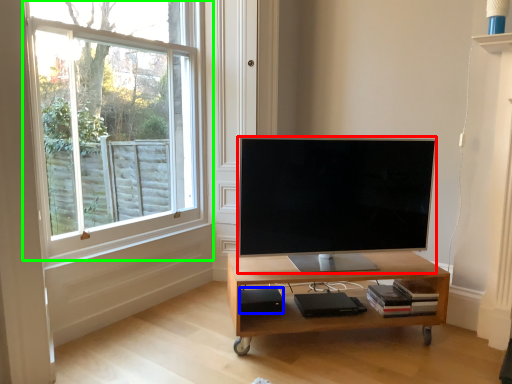
Question: Based on their relative distances, which object is farther from television (highlighted by a red box)? Choose from speaker (highlighted by a blue box) and window (highlighted by a green box).

Choices:
 (A) speaker
 (B) window

Answer: (B)